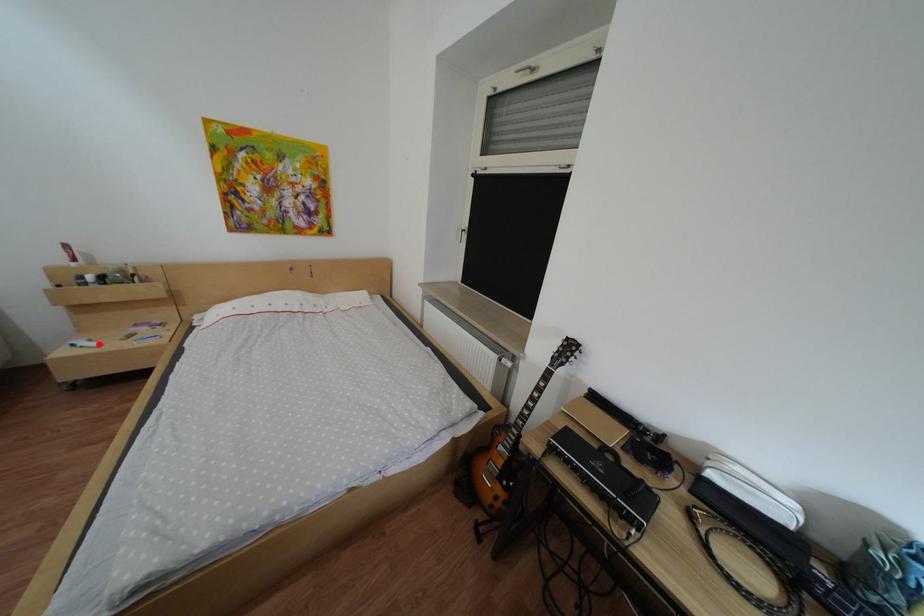
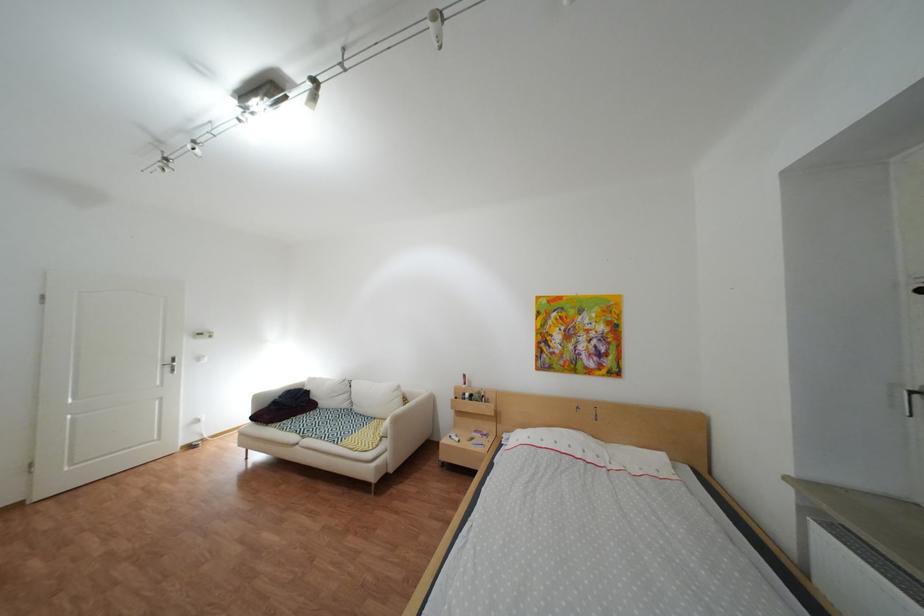
Question: A red point is marked in image1. In image2, is the corresponding 3D point closer to the camera or farther? Reply with the corresponding letter.

Choices:
 (A) The corresponding 3D point is closer.
 (B) The corresponding 3D point is farther.

Answer: (B)